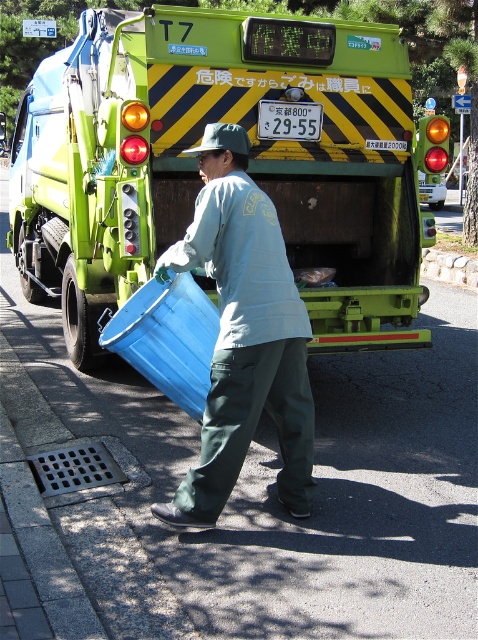
Does green matte truck at center have a lesser width compared to matte blue plastic bin at center?

In fact, green matte truck at center might be wider than matte blue plastic bin at center.

Who is higher up, green matte truck at center or matte blue plastic bin at center?

Positioned higher is green matte truck at center.

Is point (123, 38) positioned behind point (208, 468)?

Yes.

Identify the location of green matte truck at center. Image resolution: width=478 pixels, height=640 pixels. (249, 170).